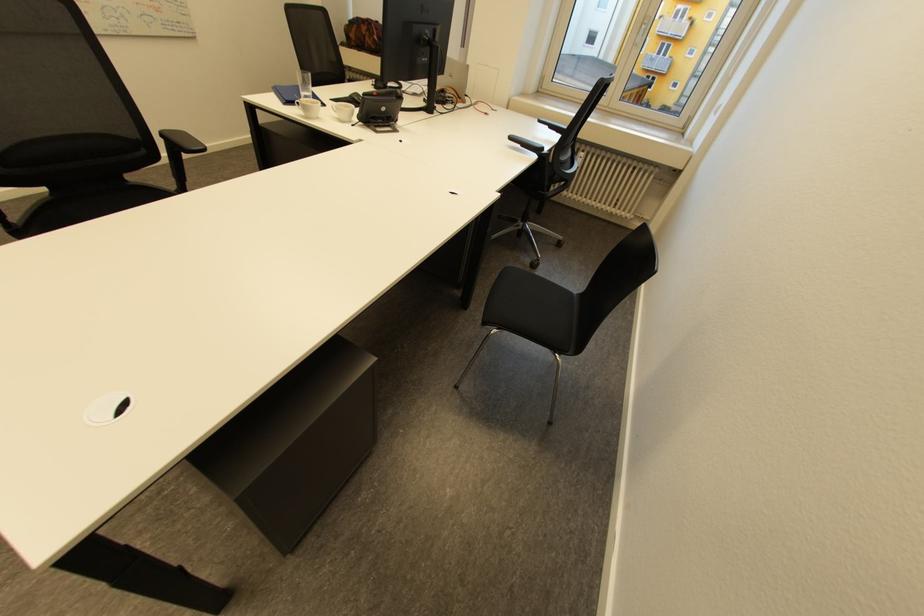
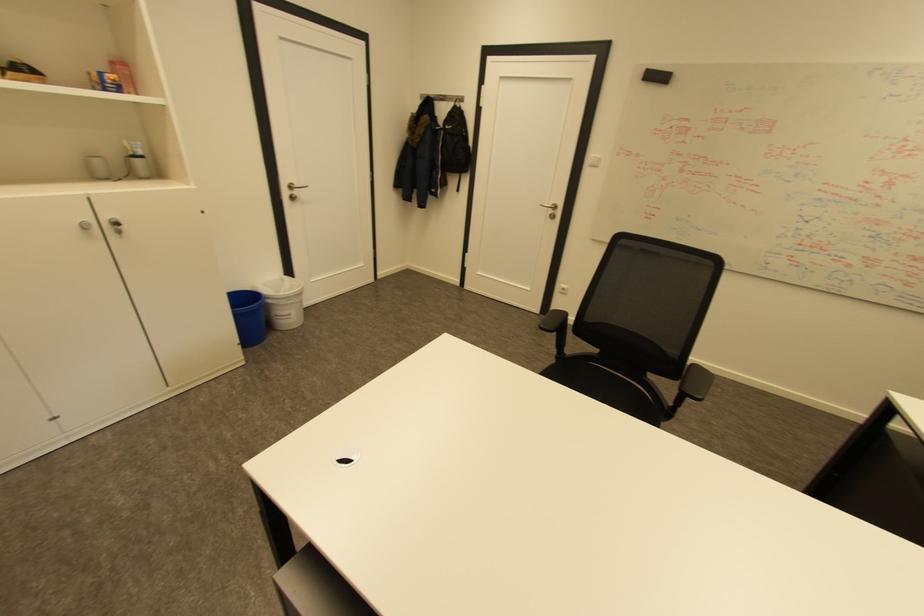
Question: The images are taken continuously from a first-person perspective. In which direction is your viewpoint rotating?

Choices:
 (A) Left
 (B) Right
 (C) Up
 (D) Down

Answer: (A)